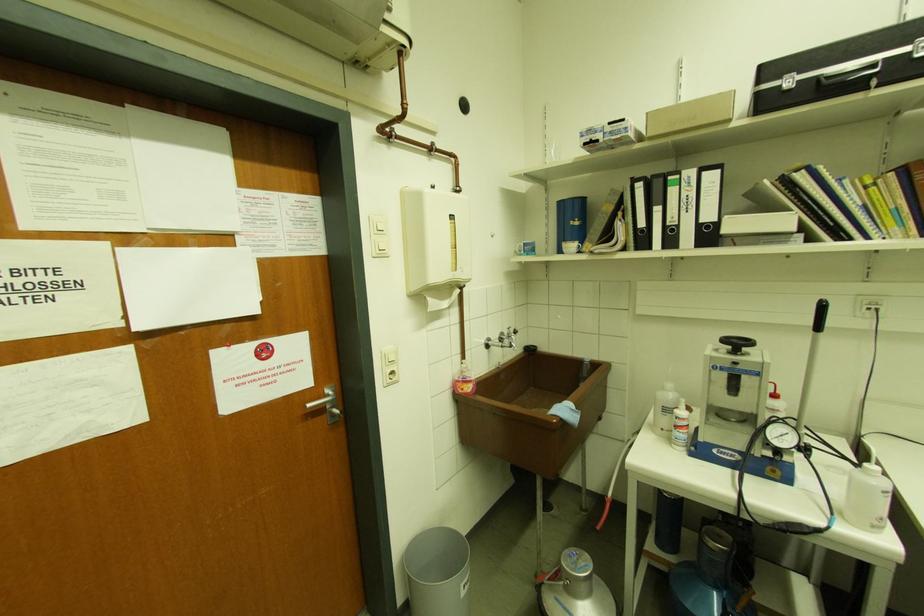
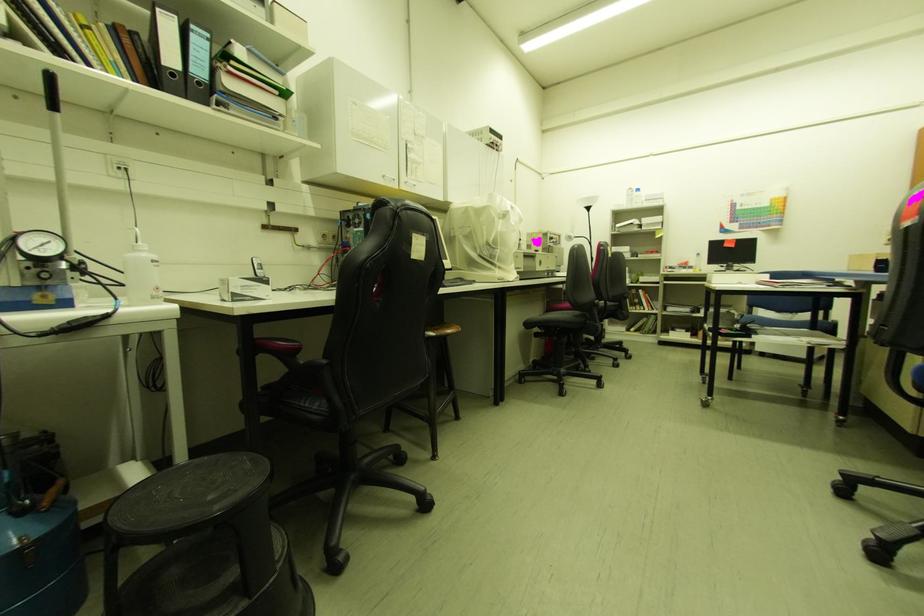
Question: The first image is from the beginning of the video and the second image is from the end. How did the camera likely rotate when shooting the video?

Choices:
 (A) Left
 (B) Right
 (C) Up
 (D) Down

Answer: (B)